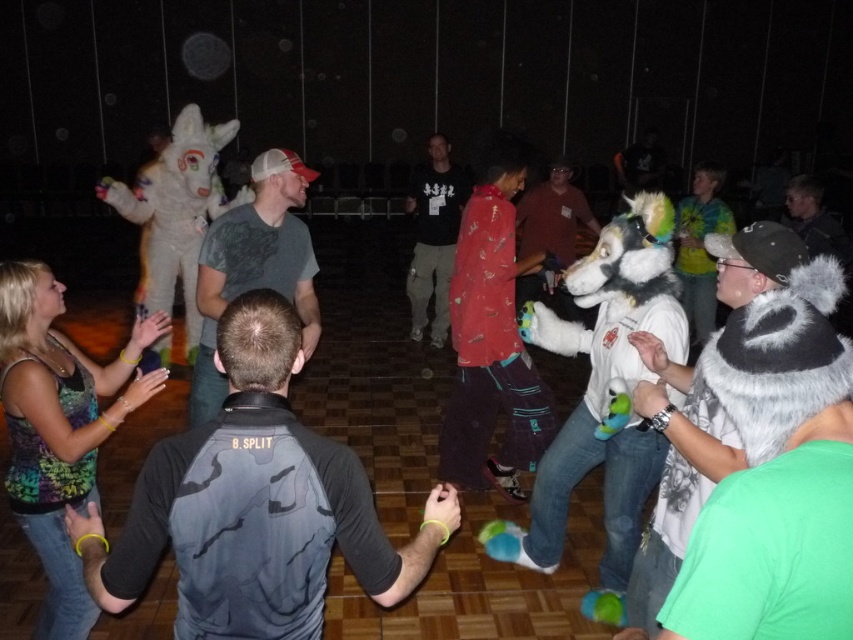
Image resolution: width=853 pixels, height=640 pixels. Describe the element at coordinates (254, 266) in the screenshot. I see `gray matte t-shirt at center` at that location.

Is gray matte t-shirt at center in front of multicolored fabric tank top at lower left?

Yes, it is.

This screenshot has width=853, height=640. What do you see at coordinates (254, 266) in the screenshot? I see `gray matte t-shirt at center` at bounding box center [254, 266].

Find the location of a particular element. gray matte t-shirt at center is located at coordinates (254, 266).

Is gray matte t-shirt at center below white plush animal at left?

Yes, gray matte t-shirt at center is below white plush animal at left.

Can you confirm if gray matte t-shirt at center is positioned above white plush animal at left?

Actually, gray matte t-shirt at center is below white plush animal at left.

Does point (247, 266) come in front of point (144, 237)?

Yes.

You are a GUI agent. You are given a task and a screenshot of the screen. Output one action in this format:
    pyautogui.click(x=<x>, y=<y>)
    Task: Click on the gray matte t-shirt at center
    
    Given the screenshot: What is the action you would take?
    pyautogui.click(x=254, y=266)

Between white plush dog at center and gray matte t-shirt at center, which one appears on the right side from the viewer's perspective?

white plush dog at center is more to the right.

Does white plush dog at center have a smaller size compared to gray matte t-shirt at center?

Yes.

You are a GUI agent. You are given a task and a screenshot of the screen. Output one action in this format:
    pyautogui.click(x=<x>, y=<y>)
    Task: Click on the white plush dog at center
    The image size is (853, 640).
    Given the screenshot: What is the action you would take?
    point(602,396)

At what (x,y) coordinates should I click in order to perform the action: click on white plush dog at center. Please return your answer as a coordinate pair (x, y). Image resolution: width=853 pixels, height=640 pixels. Looking at the image, I should click on (602, 396).